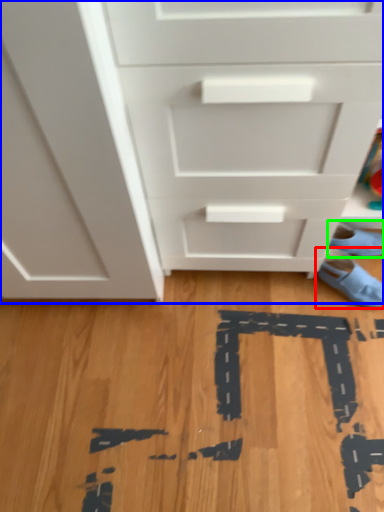
Question: Which object is positioned farthest from footwear (highlighted by a red box)? Select from chest of drawers (highlighted by a blue box) and footwear (highlighted by a green box).

Choices:
 (A) chest of drawers
 (B) footwear

Answer: (A)